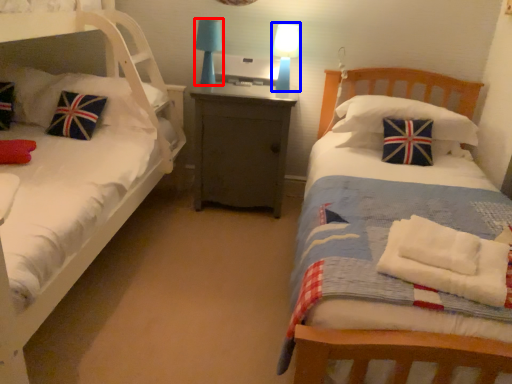
Question: Which of the following is the closest to the observer, table lamp (highlighted by a red box) or table lamp (highlighted by a blue box)?

Choices:
 (A) table lamp
 (B) table lamp

Answer: (B)